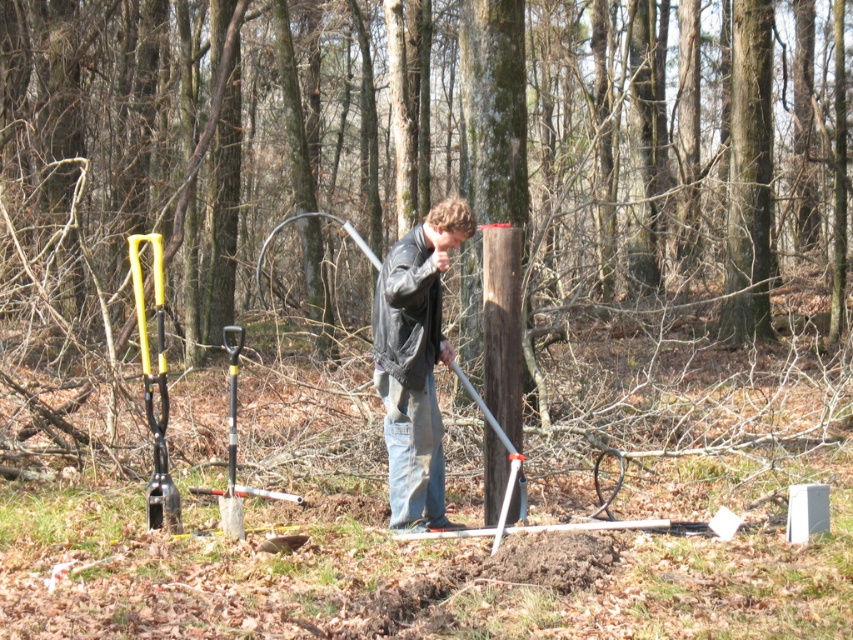
Question: Can you confirm if brown wood post at center is smaller than metallic yellow tool at left?

Choices:
 (A) yes
 (B) no

Answer: (B)

Question: Which point is farther from the camera taking this photo?

Choices:
 (A) (132, 33)
 (B) (392, 504)

Answer: (A)

Question: Is brown wood post at center bigger than metallic yellow tool at left?

Choices:
 (A) no
 (B) yes

Answer: (B)

Question: Estimate the real-world distances between objects in this image. Which object is farther from the brown wood post at center?

Choices:
 (A) metallic yellow tool at left
 (B) leather jacket at center

Answer: (A)

Question: Can you confirm if brown wood post at center is positioned above leather jacket at center?

Choices:
 (A) no
 (B) yes

Answer: (B)

Question: Based on their relative distances, which object is farther from the brown wood post at center?

Choices:
 (A) metallic yellow tool at left
 (B) leather jacket at center

Answer: (A)